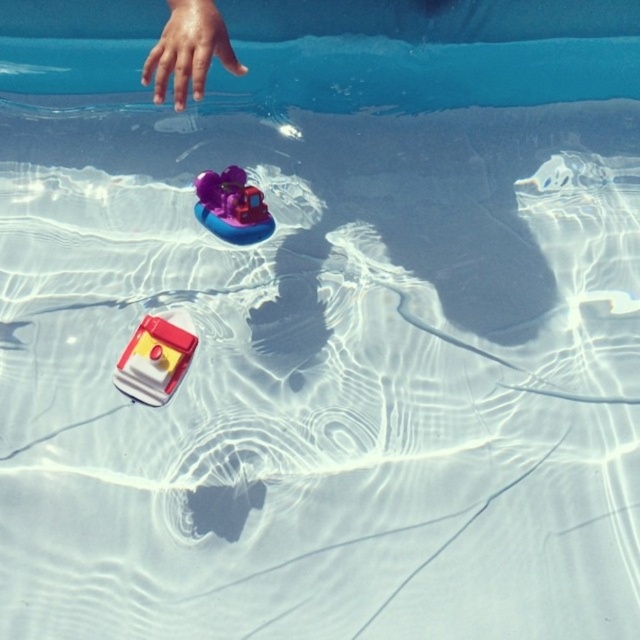
Question: Which is farther from the matte red boat at lower left?

Choices:
 (A) purple rubber duck at center
 (B) smooth skin hand at upper left

Answer: (B)

Question: Does matte red boat at lower left have a lesser width compared to purple rubber duck at center?

Choices:
 (A) yes
 (B) no

Answer: (A)

Question: In this image, where is matte red boat at lower left located relative to purple rubber duck at center?

Choices:
 (A) right
 (B) left

Answer: (B)

Question: Among these points, which one is farthest from the camera?

Choices:
 (A) (212, 228)
 (B) (172, 74)
 (C) (163, 323)

Answer: (B)

Question: Is matte red boat at lower left smaller than purple rubber duck at center?

Choices:
 (A) yes
 (B) no

Answer: (A)

Question: Which point is farther to the camera?

Choices:
 (A) (147, 323)
 (B) (208, 189)
 (C) (193, 76)

Answer: (B)